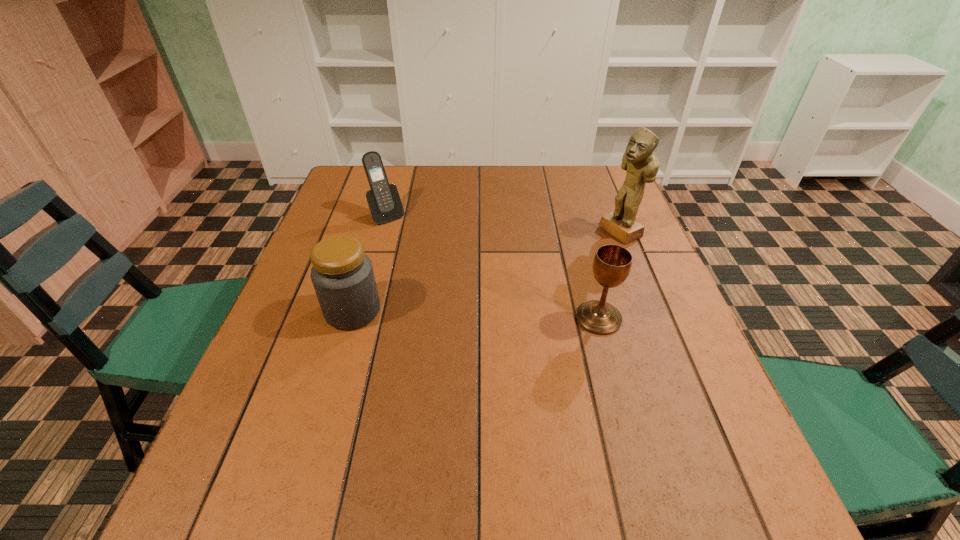
Image resolution: width=960 pixels, height=540 pixels. Find the location of `jar`. jar is located at coordinates (342, 274).

The image size is (960, 540). I want to click on chalice, so click(x=612, y=263).

The image size is (960, 540). I want to click on cellular telephone, so click(384, 202).

Where is `figurine`? figurine is located at coordinates (639, 160).

Locate an element on the screen. The image size is (960, 540). the rightmost object is located at coordinates pos(639,160).

Where is `free region located on the surface of the jar near the warning symbol`? This screenshot has height=540, width=960. free region located on the surface of the jar near the warning symbol is located at coordinates (500, 311).

I want to click on vacant region located 0.070m on the right of the second object from right to left, so click(x=653, y=318).

Where is `vacant space located 0.250m on the front-facing side of the cellular telephone`? This screenshot has width=960, height=540. vacant space located 0.250m on the front-facing side of the cellular telephone is located at coordinates (436, 274).

What are the coordinates of `vacant area situated on the front-facing side of the cellular telephone` in the screenshot? It's located at (466, 308).

You are a GUI agent. You are given a task and a screenshot of the screen. Output one action in this format:
    pyautogui.click(x=<x>, y=<y>)
    Task: Click on the free space located 0.250m on the front-facing side of the cellular telephone
    The height and width of the screenshot is (540, 960).
    Given the screenshot: What is the action you would take?
    pyautogui.click(x=436, y=274)